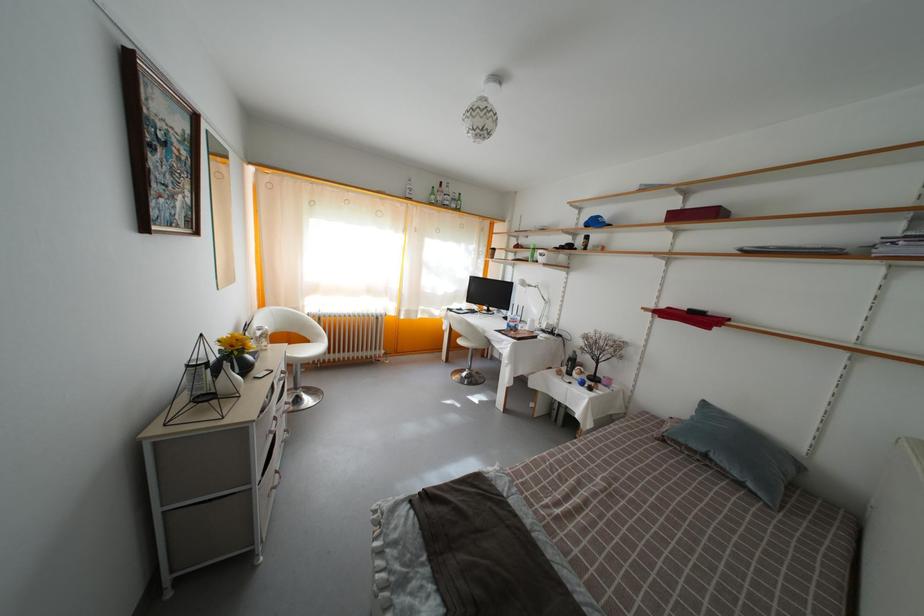
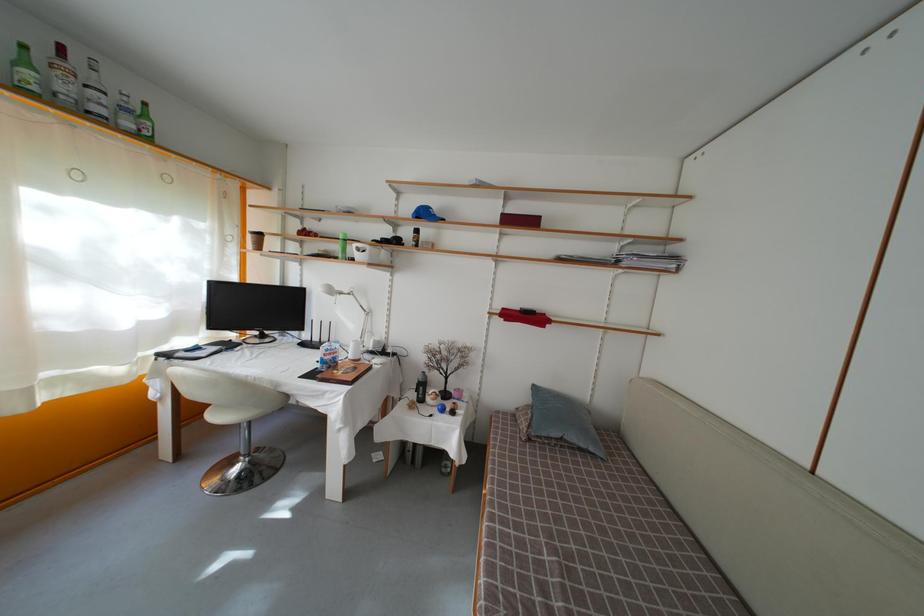
The point at (x=439, y=200) is marked in the first image. Where is the corresponding point in the second image?

(31, 69)